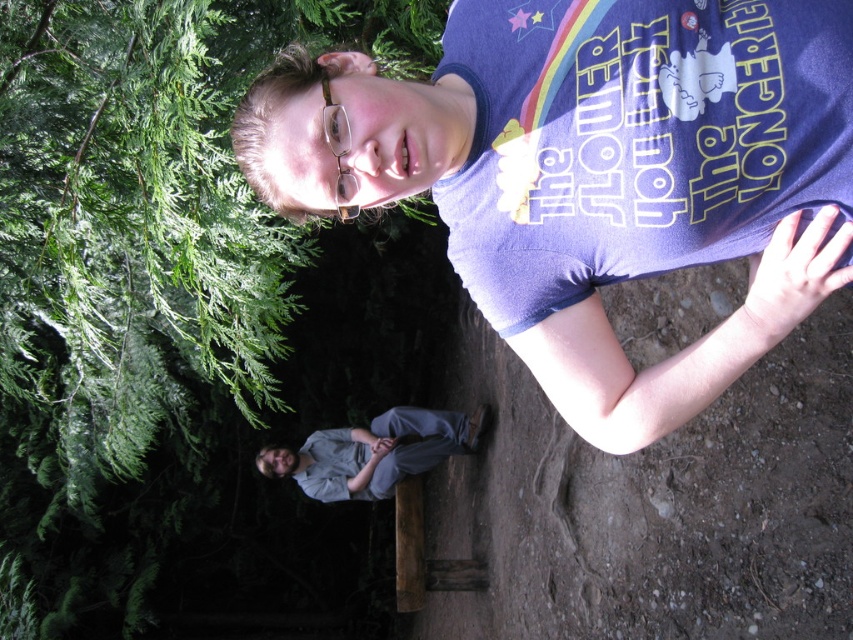
Between purple cotton t-shirt at upper center and gray cotton pants at lower center, which one appears on the left side from the viewer's perspective?

gray cotton pants at lower center

The width and height of the screenshot is (853, 640). Find the location of `purple cotton t-shirt at upper center`. purple cotton t-shirt at upper center is located at coordinates (596, 173).

Locate an element on the screen. Image resolution: width=853 pixels, height=640 pixels. purple cotton t-shirt at upper center is located at coordinates (596, 173).

Is gray cotton pants at lower center above clear plastic glasses at upper center?

Incorrect, gray cotton pants at lower center is not positioned above clear plastic glasses at upper center.

Between point (323, 435) and point (346, 214), which one is positioned in front?

Positioned in front is point (346, 214).

Which is behind, point (387, 419) or point (341, 150)?

Point (387, 419)

You are a GUI agent. You are given a task and a screenshot of the screen. Output one action in this format:
    pyautogui.click(x=<x>, y=<y>)
    Task: Click on the gray cotton pants at lower center
    Image resolution: width=853 pixels, height=640 pixels.
    Given the screenshot: What is the action you would take?
    pyautogui.click(x=374, y=452)

Is point (192, 570) farther from viewer compared to point (579, 394)?

Yes, it is.

Can you confirm if green leafy tree at upper left is taller than purple cotton t-shirt at upper center?

Correct, green leafy tree at upper left is much taller as purple cotton t-shirt at upper center.

Identify the location of green leafy tree at upper left. pos(144,298).

You are a GUI agent. You are given a task and a screenshot of the screen. Output one action in this format:
    pyautogui.click(x=<x>, y=<y>)
    Task: Click on the green leafy tree at upper left
    The height and width of the screenshot is (640, 853).
    Given the screenshot: What is the action you would take?
    pyautogui.click(x=144, y=298)